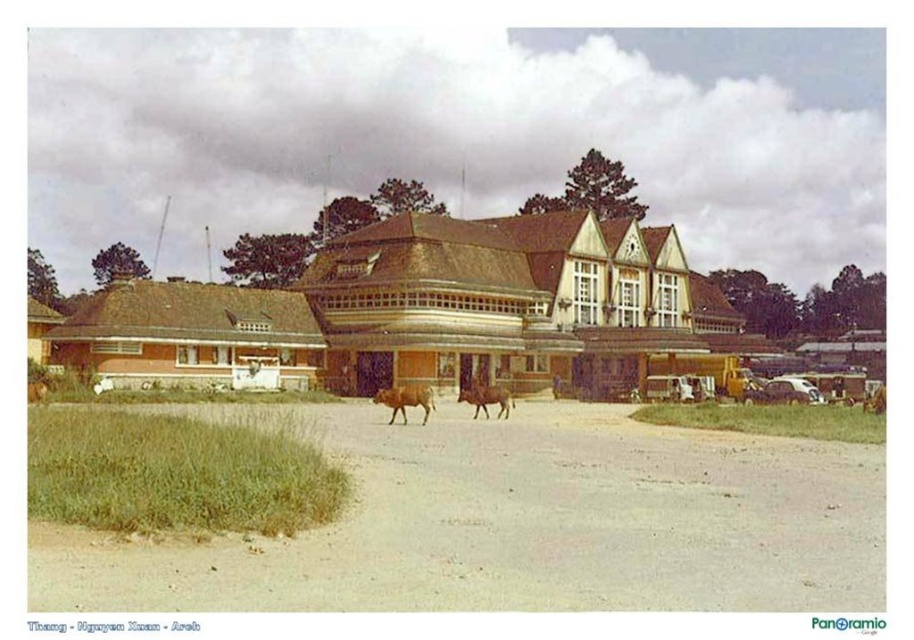
Question: Is brown matte bull at center positioned at the back of brown leather cow at center?

Choices:
 (A) yes
 (B) no

Answer: (B)

Question: Which object is positioned closest to the brown matte bull at center?

Choices:
 (A) brown leather cow at center
 (B) brown sandy dirt field at lower center

Answer: (A)

Question: Considering the relative positions of brown matte bull at center and brown leather cow at center in the image provided, where is brown matte bull at center located with respect to brown leather cow at center?

Choices:
 (A) above
 (B) below

Answer: (A)

Question: Observing the image, what is the correct spatial positioning of brown matte bull at center in reference to brown leather cow at center?

Choices:
 (A) right
 (B) left

Answer: (B)

Question: Which point is farther from the camera taking this photo?

Choices:
 (A) (507, 413)
 (B) (296, 572)

Answer: (A)

Question: Which of the following is the closest to the observer?

Choices:
 (A) (405, 401)
 (B) (498, 401)
 (C) (569, 417)

Answer: (A)